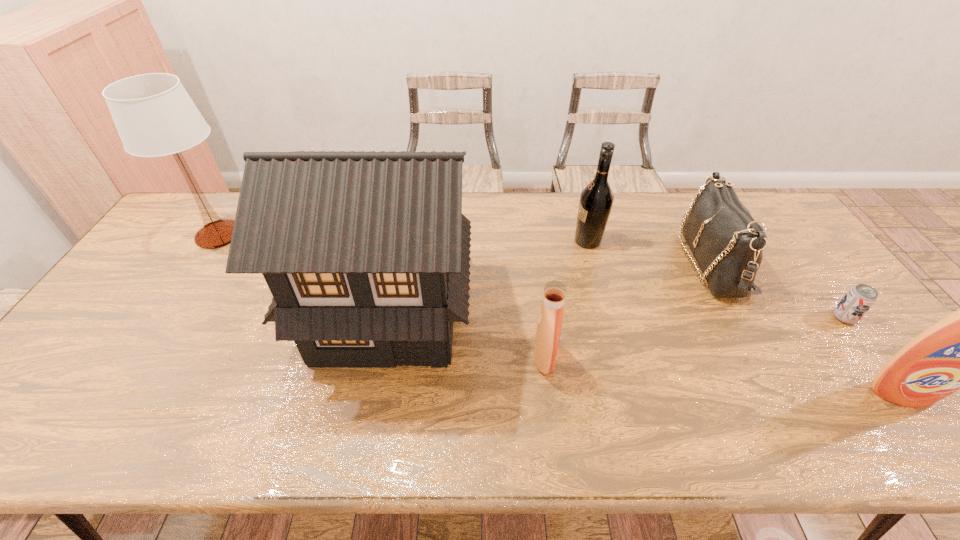
The image size is (960, 540). I want to click on dollhouse that is at the near edge, so click(x=366, y=254).

Locate an element on the screen. Image resolution: width=960 pixels, height=540 pixels. object present at the left edge is located at coordinates (154, 115).

Where is `detergent situated at the right edge`? This screenshot has height=540, width=960. detergent situated at the right edge is located at coordinates (958, 352).

This screenshot has height=540, width=960. I want to click on beer can located in the right edge section of the desktop, so click(x=859, y=299).

Find the location of a particular element. object that is at the far left corner is located at coordinates (154, 115).

Identify the location of object that is at the near right corner. Image resolution: width=960 pixels, height=540 pixels. (958, 352).

Where is `vacant space at the far edge of the desktop`? vacant space at the far edge of the desktop is located at coordinates (547, 199).

You are a GUI agent. You are given a task and a screenshot of the screen. Output one action in this format:
    pyautogui.click(x=<x>, y=<y>)
    Task: Click on the free space at the near edge of the desktop
    This screenshot has width=960, height=540.
    Given the screenshot: What is the action you would take?
    click(x=785, y=394)

Where is `vacant space at the left edge of the desktop`? vacant space at the left edge of the desktop is located at coordinates (195, 252).

This screenshot has width=960, height=540. I want to click on free space at the right edge of the desktop, so click(886, 344).